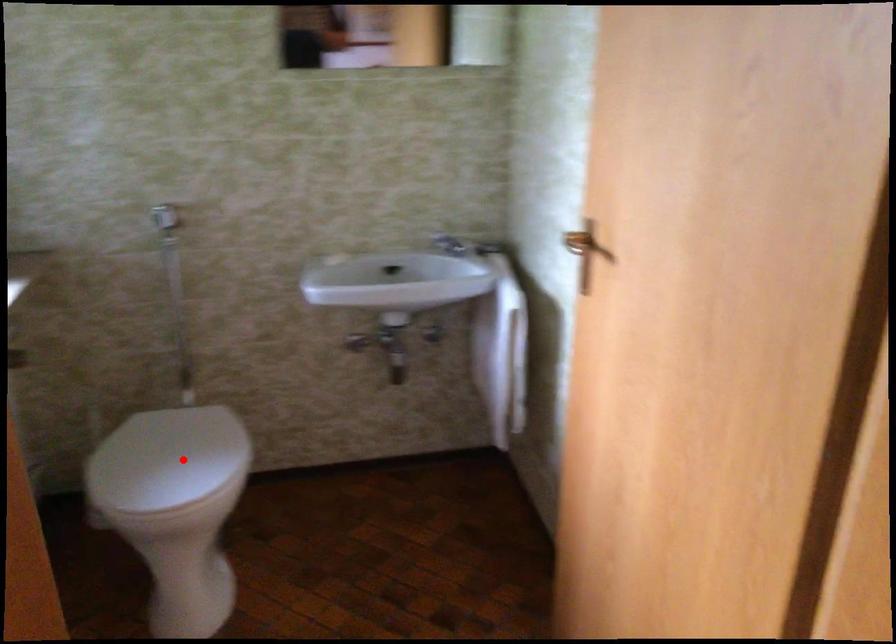
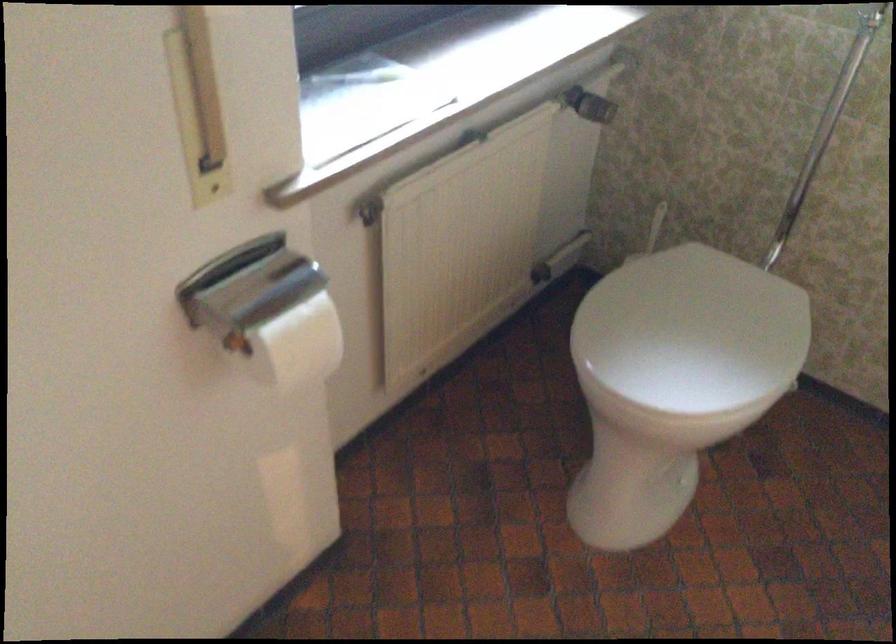
Question: I am providing you with two images of the same scene from different viewpoints. Image1 has a red point marked. In image2, the corresponding 3D location appears at what relative position? Reply with the corresponding letter.

Choices:
 (A) Closer
 (B) Farther

Answer: (A)